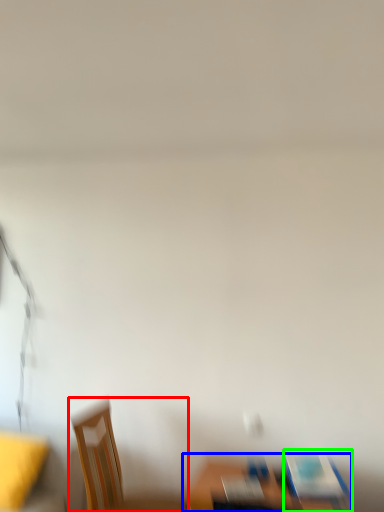
Question: Which object is positioned farthest from chair (highlighted by a red box)? Select from furniture (highlighted by a blue box) and chair (highlighted by a green box).

Choices:
 (A) furniture
 (B) chair

Answer: (B)